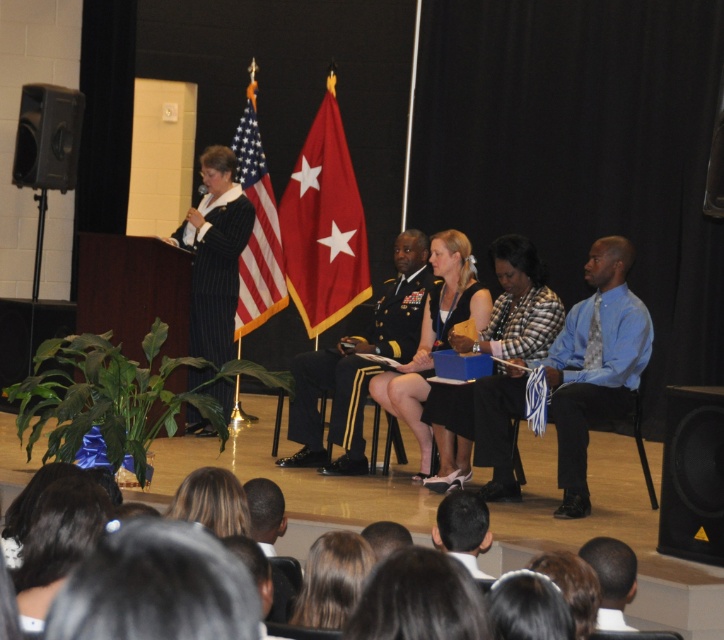
Measure the distance from shiny black hair at lower right to dark skin head at lower center.

shiny black hair at lower right is 1.60 meters from dark skin head at lower center.

Who is shorter, shiny black hair at lower right or dark skin head at lower center?

Standing shorter between the two is shiny black hair at lower right.

At what (x,y) coordinates should I click in order to perform the action: click on shiny black hair at lower right. Please return your answer as a coordinate pair (x, y). This screenshot has width=724, height=640. Looking at the image, I should click on (610, 579).

Is point (16, 182) more distant than point (329, 576)?

Yes, it is.

Between black matte speaker at left and brown hair at center, which one has more height?

black matte speaker at left

Who is more forward, (x=30, y=132) or (x=316, y=588)?

Point (x=316, y=588) is more forward.

The image size is (724, 640). Find the location of `black matte speaker at left`. black matte speaker at left is located at coordinates (46, 136).

Looking at this image, who is shorter, smooth black hair at center or black matte speaker at left?

Standing shorter between the two is smooth black hair at center.

You are a GUI agent. You are given a task and a screenshot of the screen. Output one action in this format:
    pyautogui.click(x=<x>, y=<y>)
    Task: Click on the smooth black hair at center
    The image size is (724, 640).
    Given the screenshot: What is the action you would take?
    pyautogui.click(x=418, y=600)